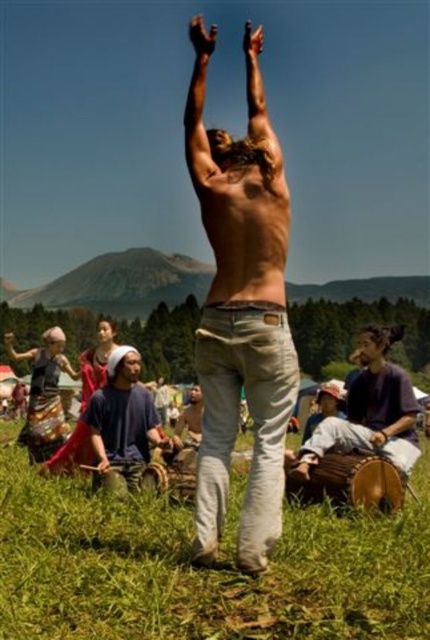
Question: Is dark blue t-shirt at lower right bigger than blue cotton shirt at center?

Choices:
 (A) no
 (B) yes

Answer: (B)

Question: Which object is positioned closest to the brown leather drum at center?

Choices:
 (A) brown leather handbag at center
 (B) blue cotton shirt at center
 (C) green grass at center

Answer: (B)

Question: Which point is closer to the camera?

Choices:
 (A) (279, 246)
 (B) (104, 388)
 (C) (202, 51)

Answer: (A)

Question: Among these points, which one is nearest to the camera?

Choices:
 (A) (242, 385)
 (B) (208, 44)
 (C) (375, 435)
 (D) (98, 468)

Answer: (A)

Question: Does shiny metallic drum at lower left come behind brown leather drum at center?

Choices:
 (A) yes
 (B) no

Answer: (A)

Question: Does green grass at center have a smaller size compared to dark blue t-shirt at lower right?

Choices:
 (A) yes
 (B) no

Answer: (A)